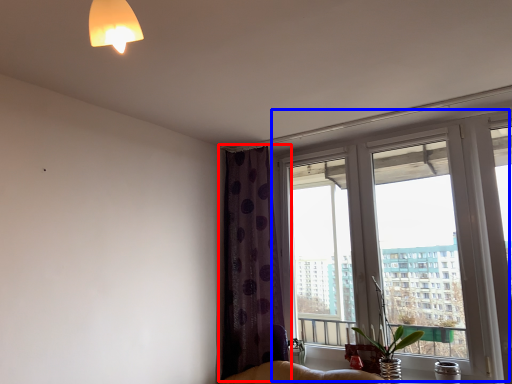
Question: Which of the following is the farthest to the observer, curtain (highlighted by a red box) or window (highlighted by a blue box)?

Choices:
 (A) curtain
 (B) window

Answer: (A)